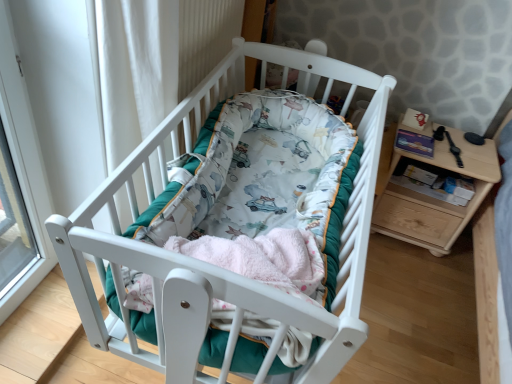
Locate an element on the screen. free point to the right of black leather watch at right is located at coordinates (479, 150).